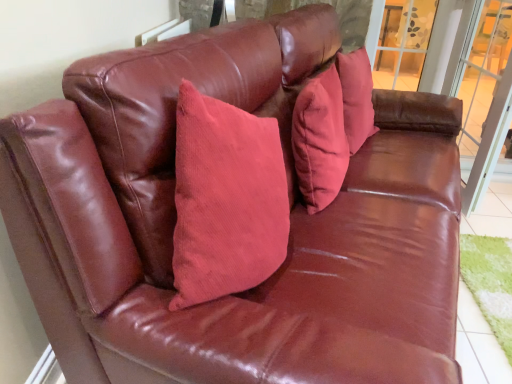
Question: Should I look upward or downward to see corduroy pillow at center?

Choices:
 (A) down
 (B) up

Answer: (B)

Question: Is clear glass window at upper right not within transparent glass screen door at right?

Choices:
 (A) yes
 (B) no

Answer: (A)

Question: Are clear glass window at upper right and transparent glass screen door at right beside each other?

Choices:
 (A) yes
 (B) no

Answer: (B)

Question: From the image's perspective, would you say clear glass window at upper right is shown under transparent glass screen door at right?

Choices:
 (A) yes
 (B) no

Answer: (B)

Question: Is clear glass window at upper right shorter than transparent glass screen door at right?

Choices:
 (A) yes
 (B) no

Answer: (A)

Question: Is clear glass window at upper right positioned with its back to transparent glass screen door at right?

Choices:
 (A) yes
 (B) no

Answer: (A)

Question: Is clear glass window at upper right positioned far away from transparent glass screen door at right?

Choices:
 (A) no
 (B) yes

Answer: (A)

Question: Is corduroy pillow at center located outside clear glass window at upper right?

Choices:
 (A) yes
 (B) no

Answer: (A)

Question: Would you say corduroy pillow at center is a long distance from clear glass window at upper right?

Choices:
 (A) no
 (B) yes

Answer: (B)

Question: Is corduroy pillow at center further to camera compared to clear glass window at upper right?

Choices:
 (A) no
 (B) yes

Answer: (A)

Question: Is corduroy pillow at center smaller than clear glass window at upper right?

Choices:
 (A) yes
 (B) no

Answer: (A)

Question: From a real-world perspective, is corduroy pillow at center physically above clear glass window at upper right?

Choices:
 (A) no
 (B) yes

Answer: (B)

Question: Is corduroy pillow at center oriented away from clear glass window at upper right?

Choices:
 (A) no
 (B) yes

Answer: (A)

Question: Is transparent glass screen door at right not near clear glass window at upper right?

Choices:
 (A) no
 (B) yes

Answer: (A)